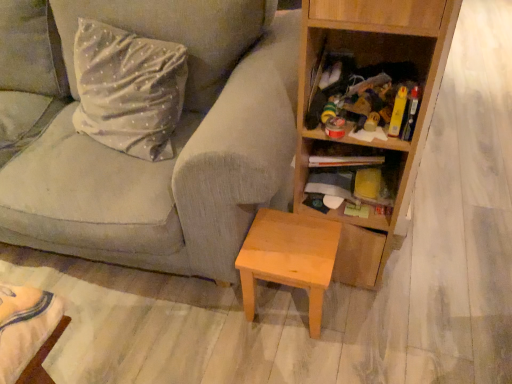
Question: Is light brown wood stool at lower center in front of or behind wooden bookcase at right in the image?

Choices:
 (A) front
 (B) behind

Answer: (B)

Question: From a real-world perspective, relative to wooden bookcase at right, is light brown wood stool at lower center vertically above or below?

Choices:
 (A) above
 (B) below

Answer: (B)

Question: Which is nearer to the light brown wood stool at lower center?

Choices:
 (A) wooden shelf at center right
 (B) wooden bookcase at right
 (C) textured gray fabric couch at center

Answer: (A)

Question: Which object is positioned closest to the wooden bookcase at right?

Choices:
 (A) textured gray fabric couch at center
 (B) light brown wood stool at lower center
 (C) wooden shelf at center right

Answer: (C)